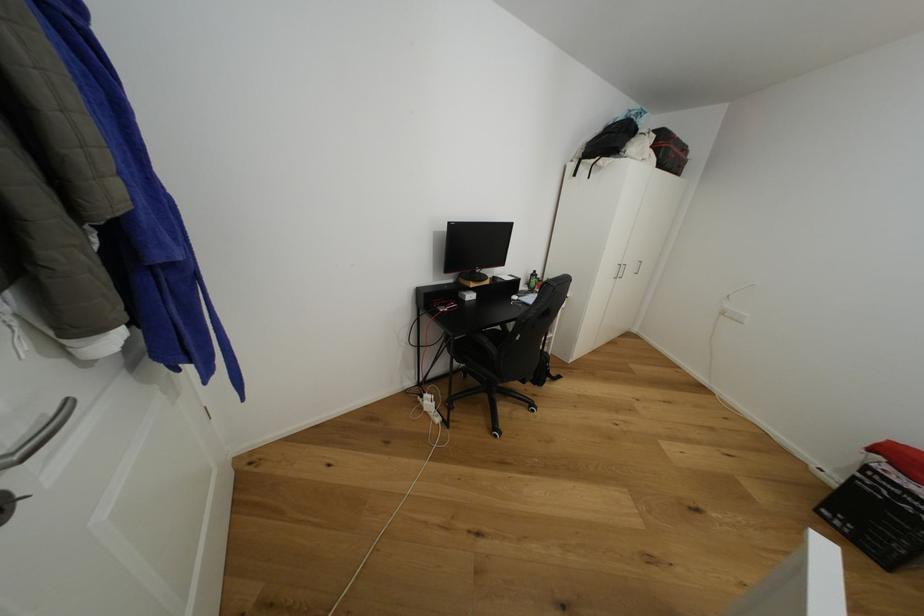
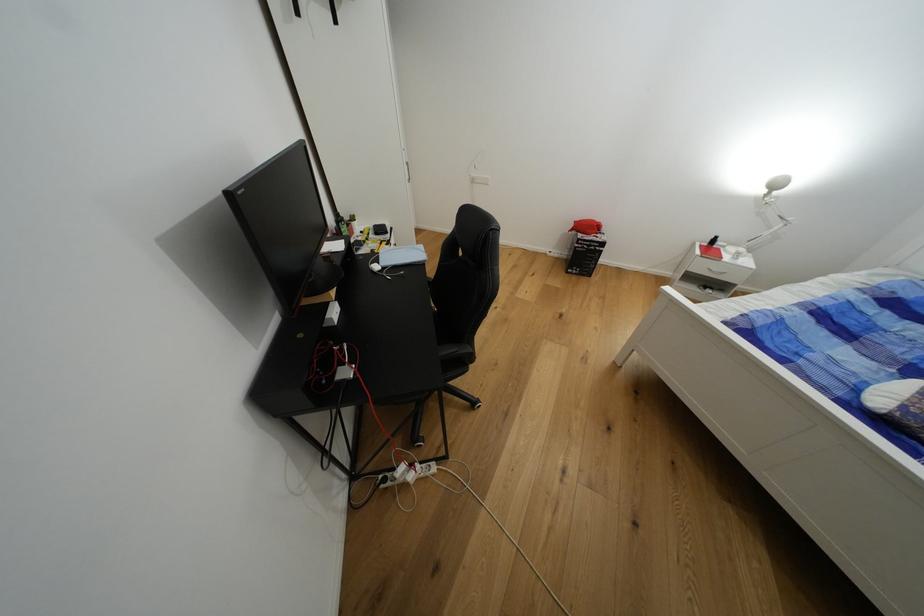
The point at [876,451] is marked in the first image. Where is the corresponding point in the second image?

(576, 232)